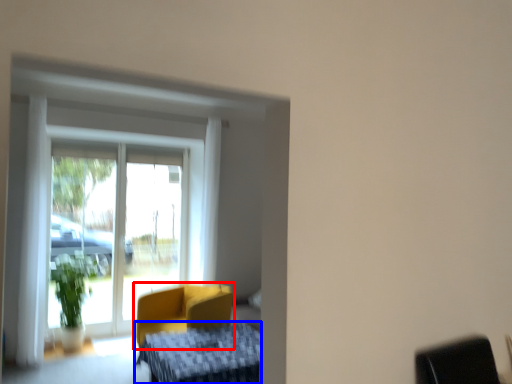
Question: Which object is closer to the camera taking this photo, chair (highlighted by a red box) or furniture (highlighted by a blue box)?

Choices:
 (A) chair
 (B) furniture

Answer: (B)